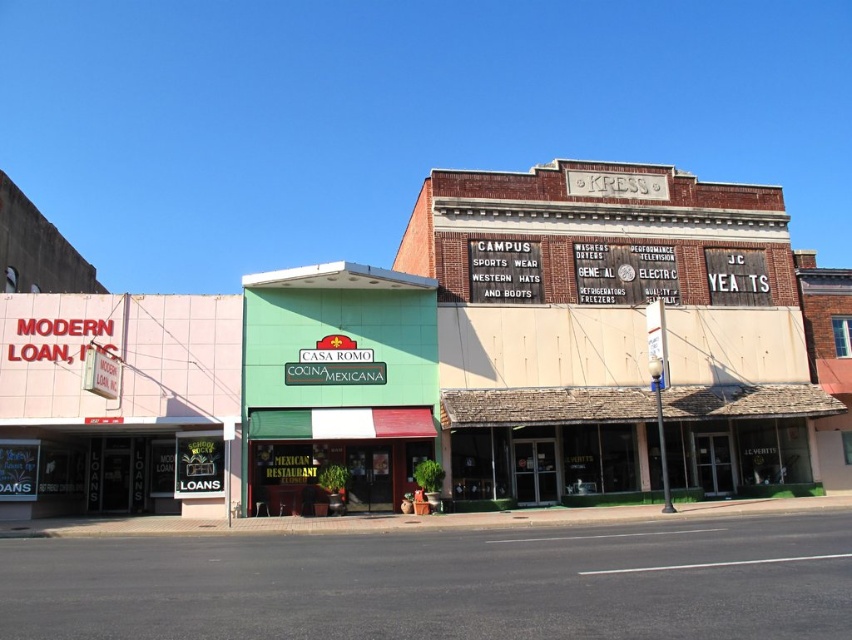
You are a tourist walking along the street and see the green painted building at center and the green matte signboard at center. Which one is closer to the left side of the street?

The green matte signboard at center is closer to the left side of the street since the green painted building at center is positioned to its right.

You are a tourist walking down the street and want to enter the green painted building at center. There is a green matte signboard at center in front of it. Can you walk through the space between them?

The green painted building at center is closer to the viewer than the green matte signboard at center, so there is no space between them for you to walk through.

You are standing at the intersection and want to walk towards the pink building on the left. There are two points marked on the ground ahead of you, point A at coordinates point (784, 474) and point B at coordinates point (340, 442). Which point should you step on first as you move forward?

You should step on point A at coordinates point (784, 474) first because it is closer to you than point B at coordinates point (340, 442).